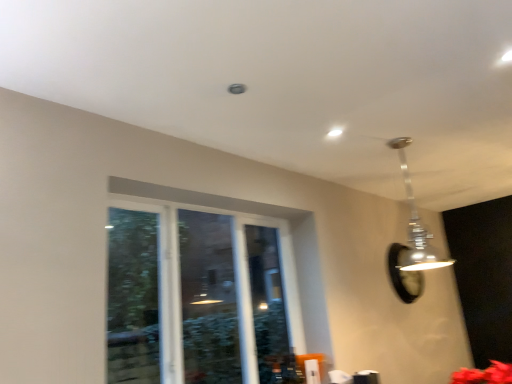
Question: Choose the correct answer: Is clear glass window at center inside metallic silver pendant light at upper right or outside it?

Choices:
 (A) outside
 (B) inside

Answer: (A)

Question: In terms of height, does clear glass window at center look taller or shorter compared to metallic silver pendant light at upper right?

Choices:
 (A) short
 (B) tall

Answer: (B)

Question: Estimate the real-world distances between objects in this image. Which object is farther from the metallic silver pendant light at upper right?

Choices:
 (A) black glass mirror at upper right
 (B) clear glass window at center

Answer: (B)

Question: Estimate the real-world distances between objects in this image. Which object is farther from the clear glass window at center?

Choices:
 (A) black glass mirror at upper right
 (B) metallic silver pendant light at upper right

Answer: (A)